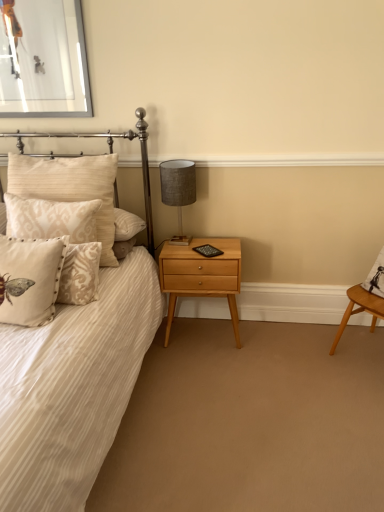
Question: Does white striped fabric bed at left have a smaller size compared to beige velvet pillow at left, the 2th pillow when ordered from back to front?

Choices:
 (A) no
 (B) yes

Answer: (A)

Question: From a real-world perspective, does white striped fabric bed at left stand above beige velvet pillow at left, the 2th pillow when ordered from back to front?

Choices:
 (A) no
 (B) yes

Answer: (A)

Question: Considering the relative sizes of white striped fabric bed at left and beige velvet pillow at left, which is the 2th pillow in front-to-back order, in the image provided, is white striped fabric bed at left bigger than beige velvet pillow at left, which is the 2th pillow in front-to-back order,?

Choices:
 (A) no
 (B) yes

Answer: (B)

Question: Can we say white striped fabric bed at left lies outside beige velvet pillow at left, which is the 2th pillow in front-to-back order?

Choices:
 (A) no
 (B) yes

Answer: (B)

Question: Does white striped fabric bed at left have a lesser width compared to beige velvet pillow at left, which is the 2th pillow in front-to-back order?

Choices:
 (A) yes
 (B) no

Answer: (B)

Question: Is white striped fabric bed at left further to camera compared to beige velvet pillow at left, the 2th pillow when ordered from back to front?

Choices:
 (A) yes
 (B) no

Answer: (B)

Question: Considering the relative positions of white striped fabric bed at left and light wood/texture nightstand at lower center in the image provided, is white striped fabric bed at left to the right of light wood/texture nightstand at lower center from the viewer's perspective?

Choices:
 (A) yes
 (B) no

Answer: (B)

Question: Is white striped fabric bed at left looking in the opposite direction of light wood/texture nightstand at lower center?

Choices:
 (A) yes
 (B) no

Answer: (B)

Question: Does white striped fabric bed at left turn towards light wood/texture nightstand at lower center?

Choices:
 (A) no
 (B) yes

Answer: (A)

Question: Are white striped fabric bed at left and light wood/texture nightstand at lower center beside each other?

Choices:
 (A) no
 (B) yes

Answer: (A)

Question: Does white striped fabric bed at left have a lesser height compared to light wood/texture nightstand at lower center?

Choices:
 (A) yes
 (B) no

Answer: (B)

Question: From a real-world perspective, is white striped fabric bed at left physically below light wood/texture nightstand at lower center?

Choices:
 (A) no
 (B) yes

Answer: (A)

Question: Is light wood/texture nightstand at lower center oriented away from white striped fabric bed at left?

Choices:
 (A) no
 (B) yes

Answer: (A)